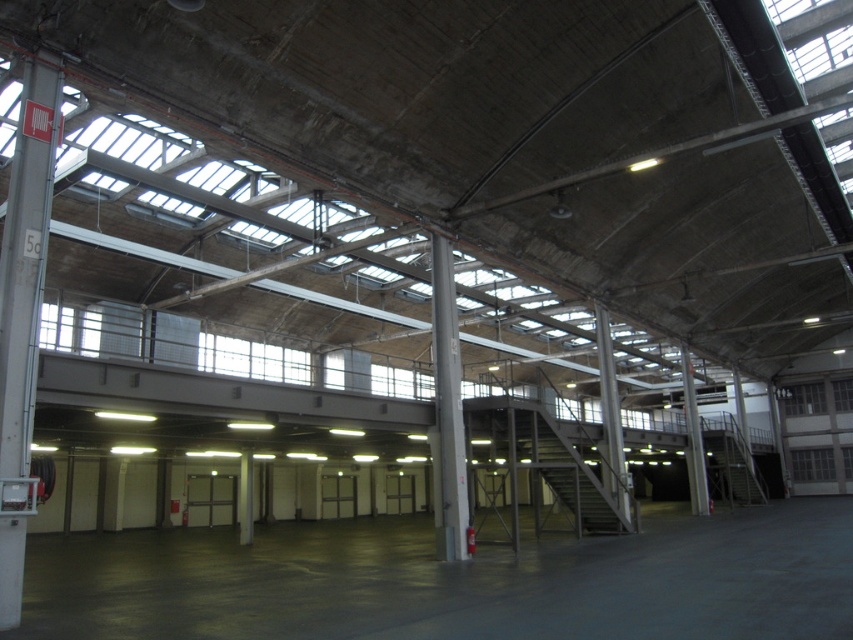
Does metallic gray pillar at center have a lesser height compared to gray concrete pillar at center?

In fact, metallic gray pillar at center may be taller than gray concrete pillar at center.

Does metallic gray pillar at center appear under gray concrete pillar at center?

No.

Between point (692, 484) and point (247, 520), which one is positioned in front?

Point (247, 520) is in front.

At what (x,y) coordinates should I click in order to perform the action: click on metallic gray pillar at center. Please return your answer as a coordinate pair (x, y). Image resolution: width=853 pixels, height=640 pixels. Looking at the image, I should click on (693, 440).

Who is higher up, metallic gray pillar at center-right or metallic gray pillar at center?

metallic gray pillar at center-right

Can you confirm if metallic gray pillar at center-right is taller than metallic gray pillar at center?

No, metallic gray pillar at center-right is not taller than metallic gray pillar at center.

Between point (619, 419) and point (692, 509), which one is positioned in front?

Positioned in front is point (619, 419).

Where is `metallic gray pillar at center-right`? This screenshot has width=853, height=640. metallic gray pillar at center-right is located at coordinates (611, 416).

Is point (24, 248) farther from camera compared to point (614, 445)?

No, it is in front of (614, 445).

Locate an element on the screen. The width and height of the screenshot is (853, 640). white glossy pillar at left is located at coordinates (22, 310).

This screenshot has height=640, width=853. I want to click on white glossy pillar at left, so click(x=22, y=310).